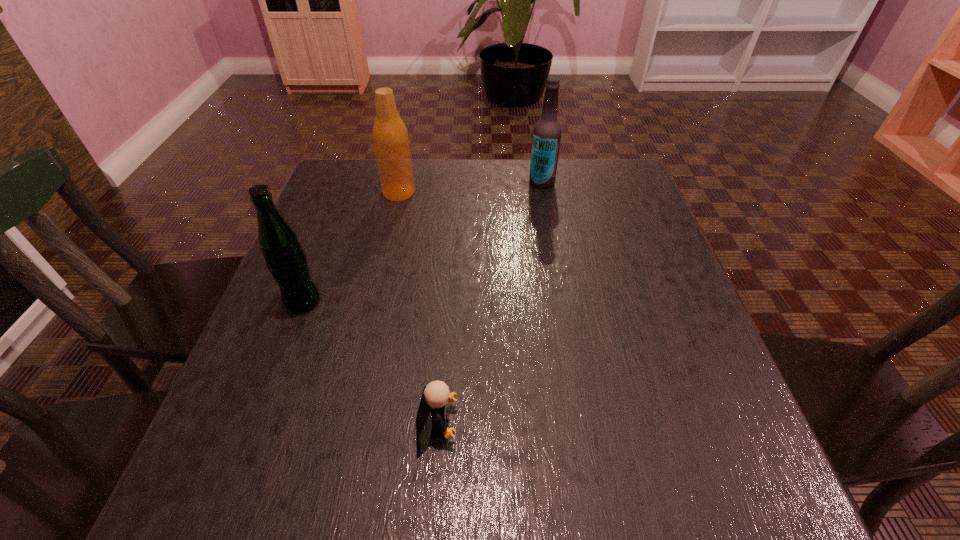
I want to click on free spot between the rightmost beer bottle and the Lego, so click(490, 303).

Where is `object that ranks as the second closest to the second beer bottle from right to left`? This screenshot has width=960, height=540. object that ranks as the second closest to the second beer bottle from right to left is located at coordinates (285, 258).

Identify the location of the second closest object relative to the nearest object. The height and width of the screenshot is (540, 960). (390, 136).

Locate which beer bottle ranks in proximity to the rightmost beer bottle. Please provide its 2D coordinates. Your answer should be formatted as a tuple, i.e. [(x, y)], where the tuple contains the x and y coordinates of a point satisfying the conditions above.

[(390, 136)]

At what (x,y) coordinates should I click in order to perform the action: click on beer bottle that stands as the second closest to the leftmost object. Please return your answer as a coordinate pair (x, y). The image size is (960, 540). Looking at the image, I should click on (547, 131).

At what (x,y) coordinates should I click in order to perform the action: click on free location that satisfies the following two spatial constraints: 1. on the back side of the second beer bottle from right to left; 2. on the left side of the leftmost beer bottle. Please return your answer as a coordinate pair (x, y). Looking at the image, I should click on (344, 193).